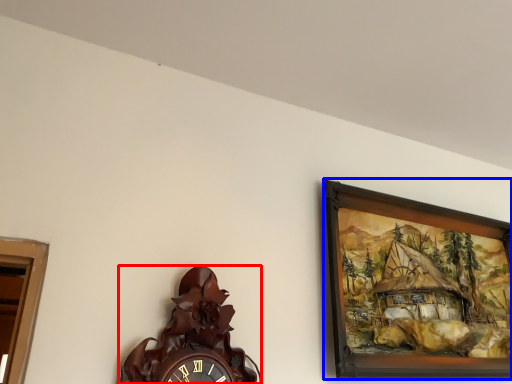
Question: Which object is closer to the camera taking this photo, wall clock (highlighted by a red box) or picture frame (highlighted by a blue box)?

Choices:
 (A) wall clock
 (B) picture frame

Answer: (A)